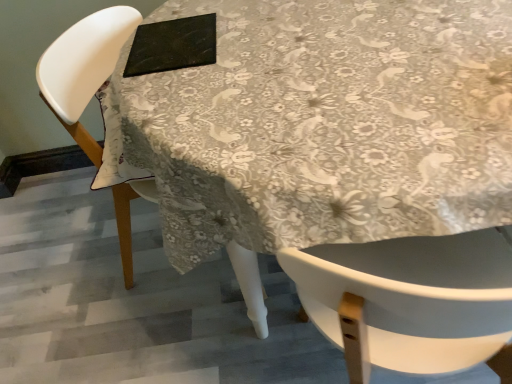
Question: Is black matte pad at upper center at the left side of white plastic chair at upper left?

Choices:
 (A) no
 (B) yes

Answer: (A)

Question: Can you confirm if black matte pad at upper center is smaller than white plastic chair at upper left?

Choices:
 (A) no
 (B) yes

Answer: (B)

Question: Could you tell me if black matte pad at upper center is turned towards white plastic chair at upper left?

Choices:
 (A) no
 (B) yes

Answer: (B)

Question: From the image's perspective, does black matte pad at upper center appear lower than white plastic chair at upper left?

Choices:
 (A) no
 (B) yes

Answer: (A)

Question: From a real-world perspective, is black matte pad at upper center beneath white plastic chair at upper left?

Choices:
 (A) yes
 (B) no

Answer: (B)

Question: In terms of size, does white plastic chair at upper left appear bigger or smaller than white glossy table at center?

Choices:
 (A) big
 (B) small

Answer: (B)

Question: Considering the positions of white plastic chair at upper left and white glossy table at center in the image, is white plastic chair at upper left taller or shorter than white glossy table at center?

Choices:
 (A) short
 (B) tall

Answer: (A)

Question: Looking at their shapes, would you say white plastic chair at upper left is wider or thinner than white glossy table at center?

Choices:
 (A) thin
 (B) wide

Answer: (A)

Question: Based on their positions, is white plastic chair at upper left located to the left or right of white glossy table at center?

Choices:
 (A) left
 (B) right

Answer: (A)

Question: In terms of height, does white plastic chair at upper left look taller or shorter compared to black matte pad at upper center?

Choices:
 (A) short
 (B) tall

Answer: (B)

Question: Do you think white plastic chair at upper left is within black matte pad at upper center, or outside of it?

Choices:
 (A) outside
 (B) inside

Answer: (A)

Question: Visually, is white plastic chair at upper left positioned to the left or to the right of black matte pad at upper center?

Choices:
 (A) left
 (B) right

Answer: (A)

Question: In terms of size, does white plastic chair at upper left appear bigger or smaller than black matte pad at upper center?

Choices:
 (A) big
 (B) small

Answer: (A)

Question: Looking at their shapes, would you say white glossy table at center is wider or thinner than black matte pad at upper center?

Choices:
 (A) wide
 (B) thin

Answer: (A)

Question: In terms of size, does white glossy table at center appear bigger or smaller than black matte pad at upper center?

Choices:
 (A) small
 (B) big

Answer: (B)